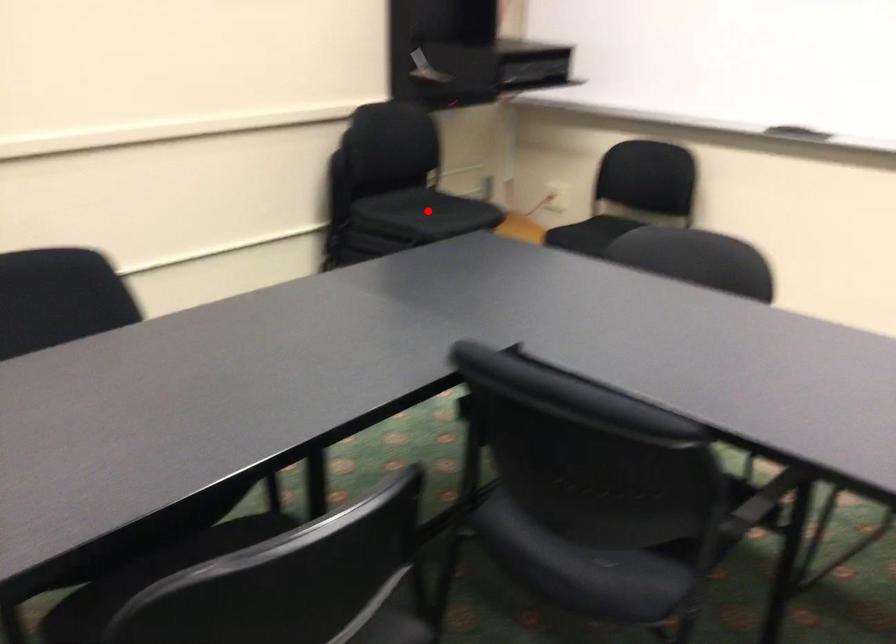
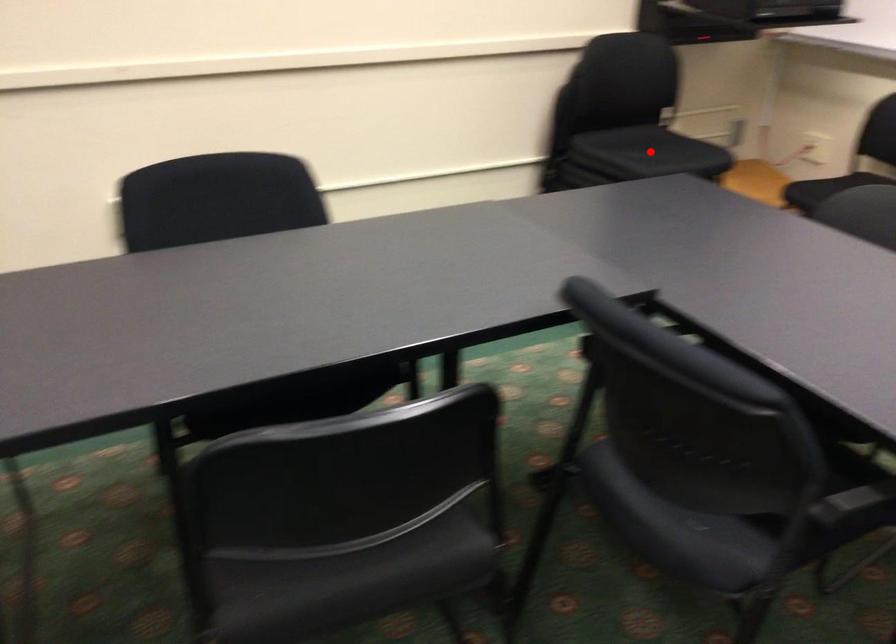
I am providing you with two images of the same scene from different viewpoints. A red point is marked on the first image and another point is marked on the second image. Is the red point in image1 aligned with the point shown in image2?

Yes